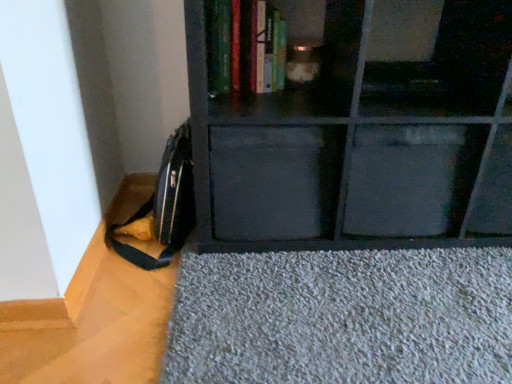
Question: Is hardcover book at upper center located outside metallic gray drawer at center, arranged as the first drawer when viewed from the right?

Choices:
 (A) no
 (B) yes

Answer: (B)

Question: From a real-world perspective, is hardcover book at upper center located beneath metallic gray drawer at center, which is the second drawer in left-to-right order?

Choices:
 (A) no
 (B) yes

Answer: (A)

Question: Does hardcover book at upper center appear on the left side of metallic gray drawer at center, which is the second drawer in left-to-right order?

Choices:
 (A) no
 (B) yes

Answer: (B)

Question: Is metallic gray drawer at center, which is the second drawer in left-to-right order, completely or partially inside hardcover book at upper center?

Choices:
 (A) no
 (B) yes

Answer: (A)

Question: Is hardcover book at upper center positioned before metallic gray drawer at center, which is the second drawer in left-to-right order?

Choices:
 (A) yes
 (B) no

Answer: (A)

Question: Looking at their shapes, would you say black matte drawer at center, positioned as the second drawer in right-to-left order, is wider or thinner than metallic gray drawer at center, arranged as the first drawer when viewed from the right?

Choices:
 (A) wide
 (B) thin

Answer: (A)

Question: Considering their positions, is black matte drawer at center, positioned as the first drawer in left-to-right order, located in front of or behind metallic gray drawer at center, which is the second drawer in left-to-right order?

Choices:
 (A) behind
 (B) front

Answer: (B)

Question: Would you say black matte drawer at center, positioned as the first drawer in left-to-right order, is to the left or to the right of metallic gray drawer at center, which is the second drawer in left-to-right order, in the picture?

Choices:
 (A) left
 (B) right

Answer: (A)

Question: Is black matte drawer at center, positioned as the first drawer in left-to-right order, inside or outside of metallic gray drawer at center, arranged as the first drawer when viewed from the right?

Choices:
 (A) outside
 (B) inside

Answer: (A)

Question: Is metallic gray drawer at center, which is the second drawer in left-to-right order, taller or shorter than matte black shelf at center?

Choices:
 (A) tall
 (B) short

Answer: (B)

Question: From a real-world perspective, is metallic gray drawer at center, which is the second drawer in left-to-right order, positioned above or below matte black shelf at center?

Choices:
 (A) above
 (B) below

Answer: (B)

Question: Is metallic gray drawer at center, which is the second drawer in left-to-right order, spatially inside matte black shelf at center, or outside of it?

Choices:
 (A) inside
 (B) outside

Answer: (A)

Question: Considering the positions of point (430, 178) and point (402, 39), is point (430, 178) closer or farther from the camera than point (402, 39)?

Choices:
 (A) closer
 (B) farther

Answer: (A)

Question: From their relative heights in the image, would you say black matte drawer at center, positioned as the second drawer in right-to-left order, is taller or shorter than matte black shelf at center?

Choices:
 (A) short
 (B) tall

Answer: (A)

Question: From a real-world perspective, is black matte drawer at center, positioned as the second drawer in right-to-left order, positioned above or below matte black shelf at center?

Choices:
 (A) above
 (B) below

Answer: (B)